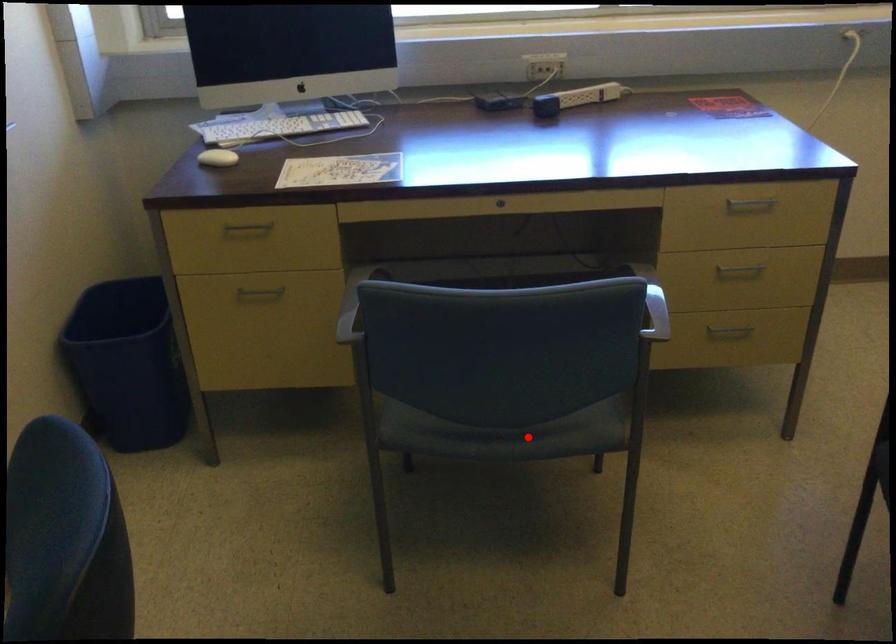
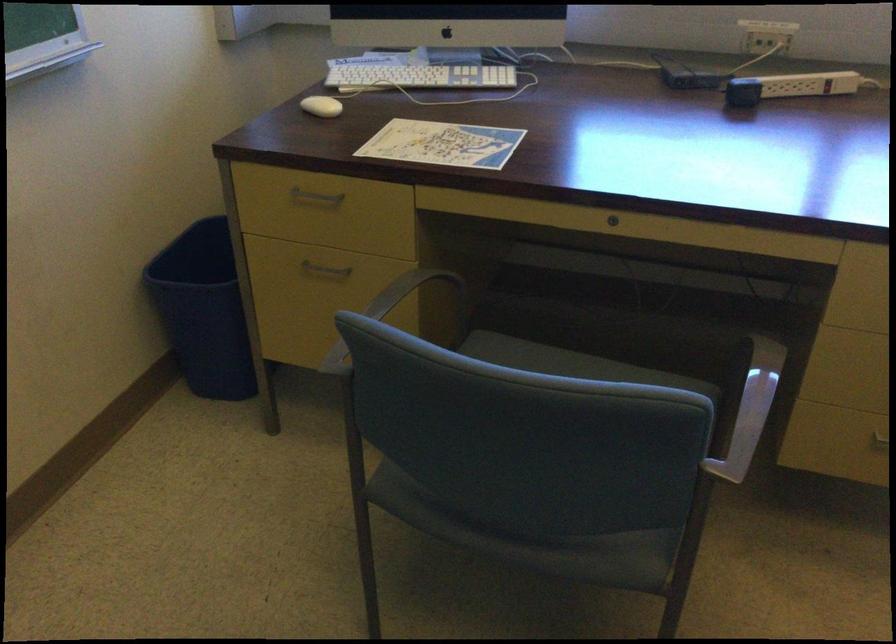
Where in the second image is the point corresponding to the highlighted location from the first image?

(538, 542)